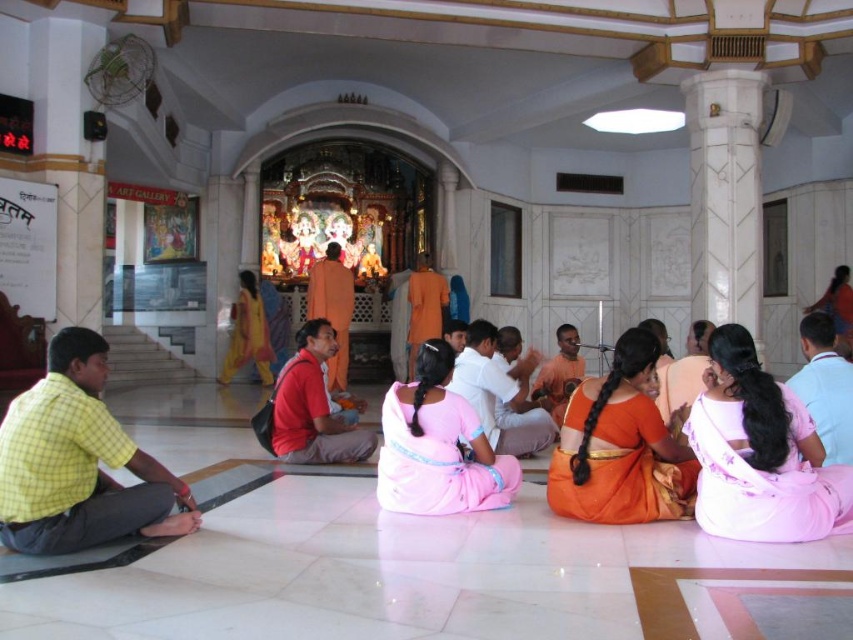
You are a photographer positioned at the back of the temple. You want to capture a photo of the orange silk saree at center and the white cotton shirt at center such that both are fully visible in the frame. Which object should you adjust your focus to ensure the shorter one is not cropped out?

The orange silk saree at center is shorter than the white cotton shirt at center, so you should adjust your focus to include the orange silk saree at center which is shorter to ensure it is fully visible in the frame.

You are a visitor standing at the entrance of the temple and want to approach the altar. There is an orange silk saree at center and a white cotton shirt at center in your path. Given that your walking path is 6 meters wide, can you walk between them without touching either?

The orange silk saree at center is 6.77 meters from the white cotton shirt at center. Since the distance between them is greater than the 6 meters width of your path, you can walk between them without touching either.